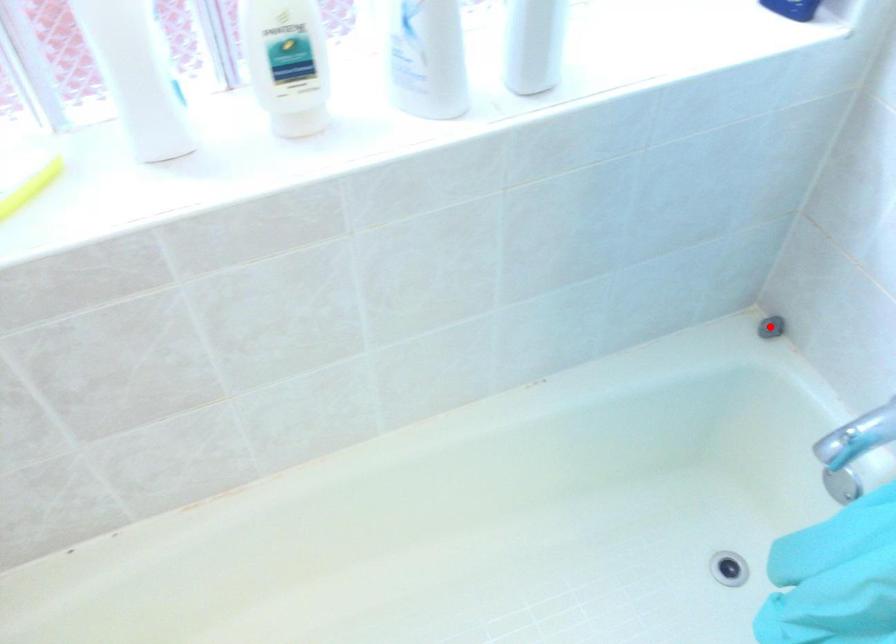
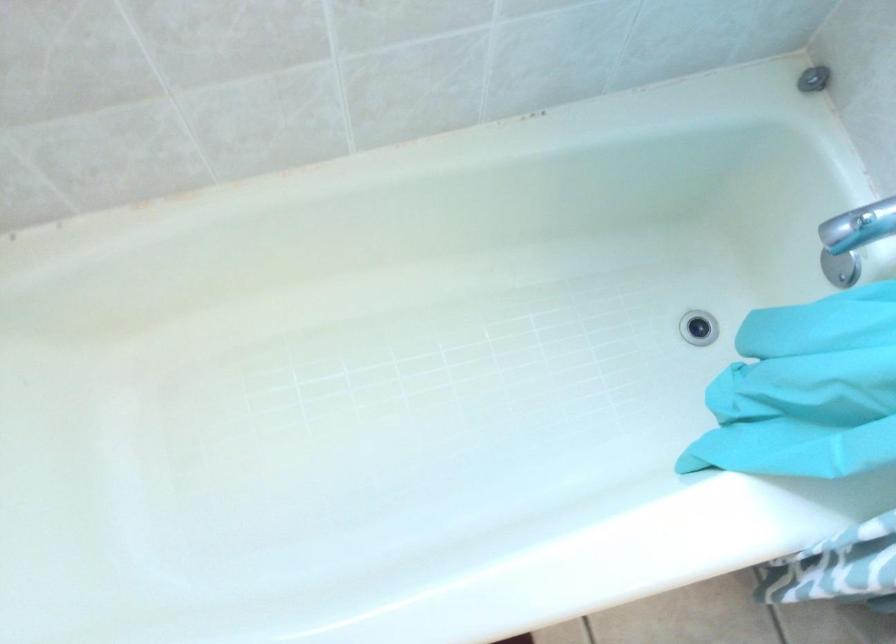
Question: A red point is marked in image1. In image2, is the corresponding 3D point closer to the camera or farther? Reply with the corresponding letter.

Choices:
 (A) The corresponding 3D point is closer.
 (B) The corresponding 3D point is farther.

Answer: (A)